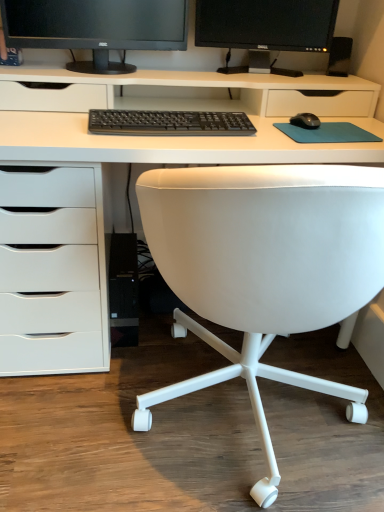
Question: Is black matte monitor at upper center, arranged as the second computer monitor when viewed from the right, taller than teal fabric mousepad at center?

Choices:
 (A) yes
 (B) no

Answer: (A)

Question: Is black matte monitor at upper center, arranged as the second computer monitor when viewed from the right, to the right of teal fabric mousepad at center from the viewer's perspective?

Choices:
 (A) yes
 (B) no

Answer: (B)

Question: Can teal fabric mousepad at center be found inside black matte monitor at upper center, arranged as the second computer monitor when viewed from the right?

Choices:
 (A) no
 (B) yes

Answer: (A)

Question: From the image's perspective, is black matte monitor at upper center, the 1th computer monitor when ordered from left to right, below teal fabric mousepad at center?

Choices:
 (A) no
 (B) yes

Answer: (A)

Question: From the image's perspective, is black matte monitor at upper center, arranged as the second computer monitor when viewed from the right, above teal fabric mousepad at center?

Choices:
 (A) yes
 (B) no

Answer: (A)

Question: In the image, is black matte mouse at right positioned in front of or behind black matte monitor at upper center, arranged as the second computer monitor when viewed from the right?

Choices:
 (A) front
 (B) behind

Answer: (B)

Question: Is black matte mouse at right to the left or to the right of black matte monitor at upper center, arranged as the second computer monitor when viewed from the right, in the image?

Choices:
 (A) left
 (B) right

Answer: (B)

Question: Considering the positions of point (307, 120) and point (41, 4), is point (307, 120) closer or farther from the camera than point (41, 4)?

Choices:
 (A) closer
 (B) farther

Answer: (A)

Question: Would you say black matte mouse at right is inside or outside black matte monitor at upper center, arranged as the second computer monitor when viewed from the right?

Choices:
 (A) inside
 (B) outside

Answer: (B)

Question: Does point (29, 5) appear closer or farther from the camera than point (264, 245)?

Choices:
 (A) closer
 (B) farther

Answer: (B)

Question: Choose the correct answer: Is black matte monitor at upper center, arranged as the second computer monitor when viewed from the right, inside white leather chair at center or outside it?

Choices:
 (A) inside
 (B) outside

Answer: (B)

Question: Based on their sizes in the image, would you say black matte monitor at upper center, arranged as the second computer monitor when viewed from the right, is bigger or smaller than white leather chair at center?

Choices:
 (A) small
 (B) big

Answer: (A)

Question: From their relative heights in the image, would you say black matte monitor at upper center, arranged as the second computer monitor when viewed from the right, is taller or shorter than white leather chair at center?

Choices:
 (A) tall
 (B) short

Answer: (B)

Question: Considering the relative positions of white leather chair at center and black plastic speaker at upper right in the image provided, is white leather chair at center to the left or to the right of black plastic speaker at upper right?

Choices:
 (A) right
 (B) left

Answer: (B)

Question: Looking at their shapes, would you say white leather chair at center is wider or thinner than black plastic speaker at upper right?

Choices:
 (A) thin
 (B) wide

Answer: (B)